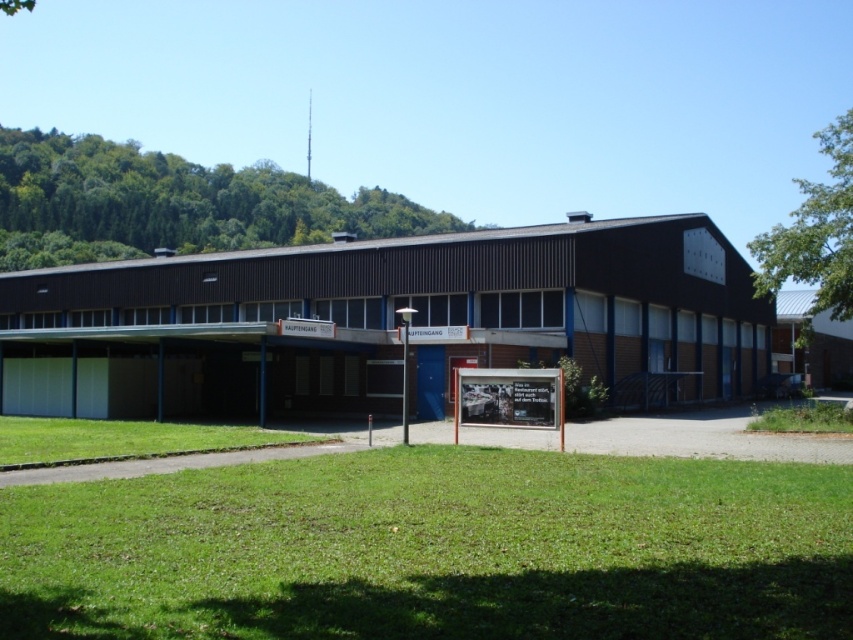
You are a gardener who needs to mow the lawn. You observe the green grass at lower center and the green grass at lower left. Which area requires immediate attention based on their height?

The green grass at lower left requires immediate attention because it is taller than the green grass at lower center.

You are standing at the entrance of the building marked by the Haupteingang sign. You see two points plotted on a map overlay of the area. The first point is at coordinates point (x=3, y=426) and the second at point (x=827, y=419). Which point is closer to your current position?

Point (x=3, y=426) is behind point (x=827, y=419), so the point closer to your current position at the entrance would be point (x=827, y=419) since it is in front of you.